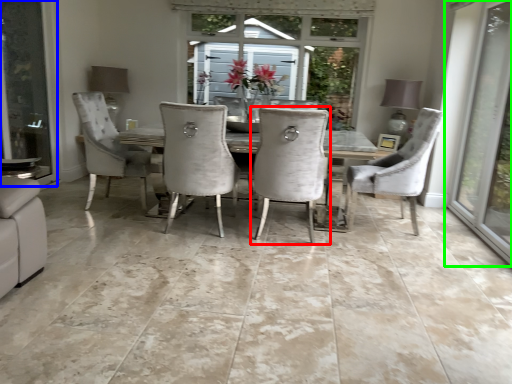
Question: Which object is positioned closest to chair (highlighted by a red box)? Select from screen door (highlighted by a blue box) and window (highlighted by a green box).

Choices:
 (A) screen door
 (B) window

Answer: (B)